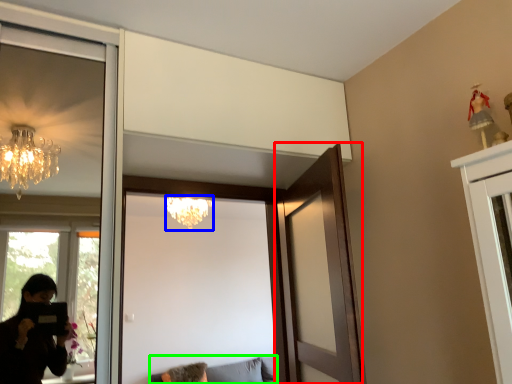
Question: Which is nearer to the door (highlighted by a red box)? lamp (highlighted by a blue box) or furniture (highlighted by a green box).

Choices:
 (A) lamp
 (B) furniture

Answer: (A)